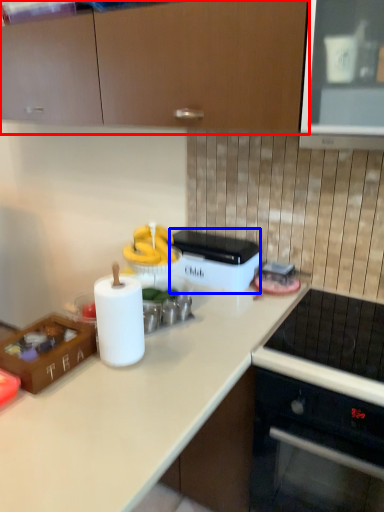
Question: Which of the following is the farthest to the observer, cabinetry (highlighted by a red box) or appliance (highlighted by a blue box)?

Choices:
 (A) cabinetry
 (B) appliance

Answer: (B)